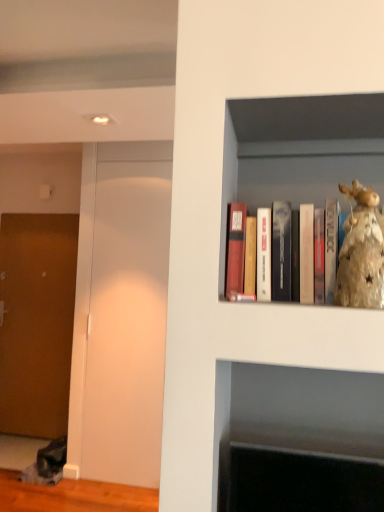
The height and width of the screenshot is (512, 384). I want to click on blank space situated above brown textured door at left (from a real-world perspective), so click(46, 215).